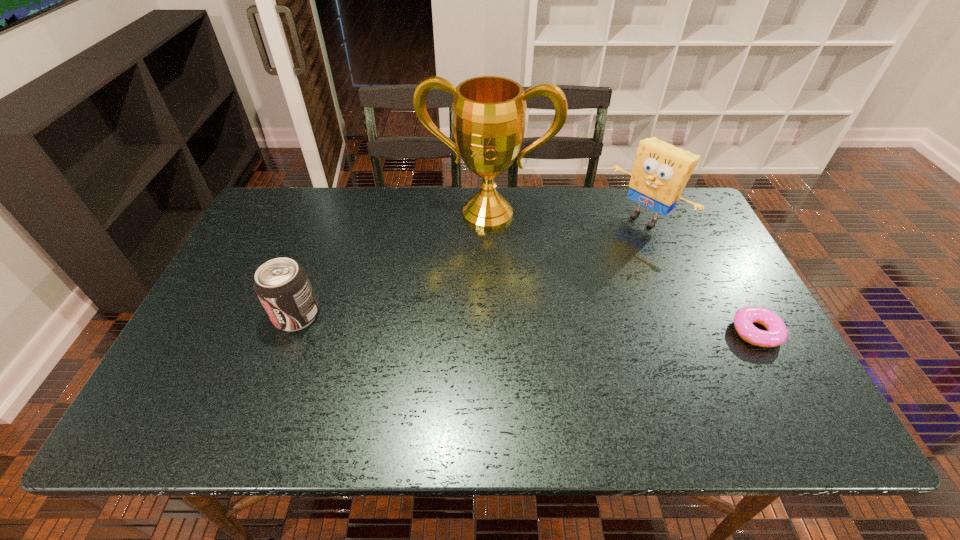
Identify the location of free area in between the tallest object and the shortest object. (622, 273).

At what (x,y) coordinates should I click in order to perform the action: click on vacant space in between the second shortest object and the third object from right to left. Please return your answer as a coordinate pair (x, y). Image resolution: width=960 pixels, height=540 pixels. Looking at the image, I should click on (392, 265).

What are the coordinates of `free space between the award and the leftmost object` in the screenshot? It's located at (392, 265).

At what (x,y) coordinates should I click in order to perform the action: click on empty space that is in between the sponge and the second object from left to right. Please return your answer as a coordinate pair (x, y). The width and height of the screenshot is (960, 540). Looking at the image, I should click on (566, 216).

The height and width of the screenshot is (540, 960). I want to click on the third closest object relative to the second shortest object, so click(777, 333).

This screenshot has height=540, width=960. Identify the location of object that can be found as the second closest to the sponge. (777, 333).

This screenshot has width=960, height=540. I want to click on vacant space that satisfies the following two spatial constraints: 1. on the front side of the sponge; 2. on the left side of the tallest object, so click(488, 219).

Locate an element on the screen. This screenshot has height=540, width=960. vacant position in the image that satisfies the following two spatial constraints: 1. on the front side of the second object from left to right; 2. on the left side of the shortest object is located at coordinates (490, 332).

The width and height of the screenshot is (960, 540). In order to click on free space that satisfies the following two spatial constraints: 1. on the back side of the third shortest object; 2. on the right side of the leftmost object in this screenshot , I will do pos(332,219).